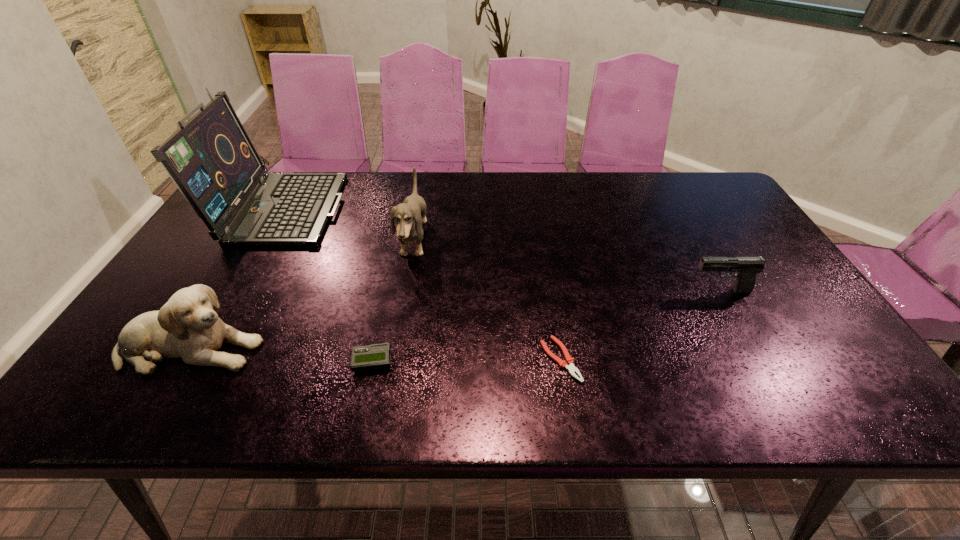
This screenshot has height=540, width=960. Identify the location of laptop computer situated at the left edge. (210, 158).

Locate an element on the screen. The width and height of the screenshot is (960, 540). puppy that is at the left edge is located at coordinates (187, 327).

Find the location of `object positioned at the right edge`. object positioned at the right edge is located at coordinates (746, 267).

Where is `object that is at the far left corner`? This screenshot has width=960, height=540. object that is at the far left corner is located at coordinates [210, 158].

The height and width of the screenshot is (540, 960). In order to click on object that is at the near left corner in this screenshot , I will do `click(187, 327)`.

Locate an element on the screen. vacant space at the far edge of the desktop is located at coordinates pyautogui.click(x=450, y=188).

Identify the location of free region at the near edge. The height and width of the screenshot is (540, 960). 309,395.

Find the location of a particular element. vacant area at the right edge of the desktop is located at coordinates (725, 211).

The image size is (960, 540). What are the coordinates of `free region at the far right corner` in the screenshot? It's located at (722, 193).

This screenshot has width=960, height=540. Identify the location of free space at the near right corner of the desktop. (819, 411).